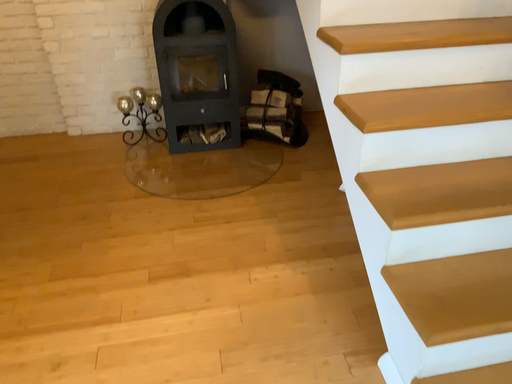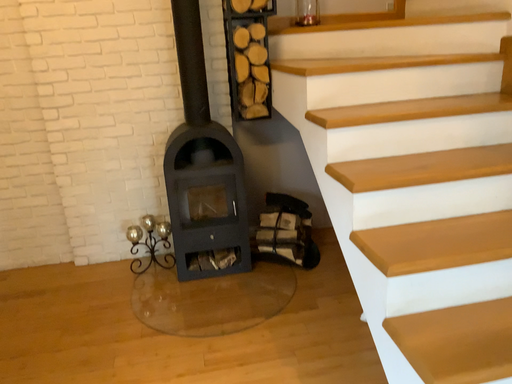
Question: How did the camera likely rotate when shooting the video?

Choices:
 (A) rotated upward
 (B) rotated downward

Answer: (A)